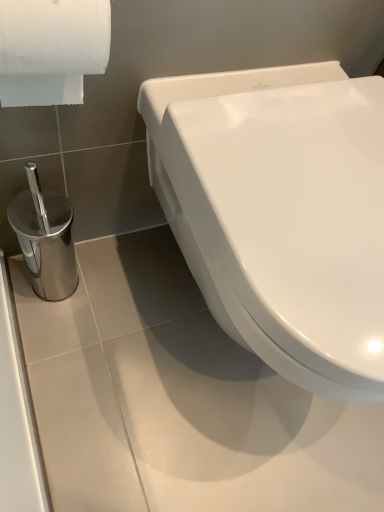
Image resolution: width=384 pixels, height=512 pixels. What do you see at coordinates (51, 49) in the screenshot?
I see `white textured toilet paper at upper left` at bounding box center [51, 49].

Find the location of `white textured toilet paper at upper left`. white textured toilet paper at upper left is located at coordinates (51, 49).

What is the approximate height of white textured toilet paper at upper left?

white textured toilet paper at upper left is 8.76 inches tall.

Describe the element at coordinates (283, 212) in the screenshot. I see `white glossy toilet at center` at that location.

In the scene shown: Measure the distance between point (308, 163) and camera.

The distance of point (308, 163) from camera is 21.65 inches.

At what (x,y) coordinates should I click in order to perform the action: click on white glossy toilet at center. Please return your answer as a coordinate pair (x, y). Looking at the image, I should click on (283, 212).

In order to face white glossy toilet at center, should I rotate leftwards or rightwards?

Rotate your view right by about 11.772°.

Identify the location of white textured toilet paper at upper left. The width and height of the screenshot is (384, 512). (51, 49).

In the scene shown: Considering the relative positions of white glossy toilet at center and white textured toilet paper at upper left in the image provided, is white glossy toilet at center to the left of white textured toilet paper at upper left from the viewer's perspective?

No.

Considering the relative positions of white glossy toilet at center and white textured toilet paper at upper left in the image provided, is white glossy toilet at center in front of white textured toilet paper at upper left?

No, it is not.

Is point (379, 240) positioned before point (10, 94)?

Yes, point (379, 240) is in front of point (10, 94).

From the image's perspective, is white glossy toilet at center located beneath white textured toilet paper at upper left?

Yes.

Consider the image. From a real-world perspective, which object rests below the other?

white glossy toilet at center is physically lower.

Is white glossy toilet at center wider than white textured toilet paper at upper left?

Indeed, white glossy toilet at center has a greater width compared to white textured toilet paper at upper left.

Who is shorter, white glossy toilet at center or white textured toilet paper at upper left?

white textured toilet paper at upper left.

Does white glossy toilet at center have a larger size compared to white textured toilet paper at upper left?

Correct, white glossy toilet at center is larger in size than white textured toilet paper at upper left.

Is white textured toilet paper at upper left completely or partially inside white glossy toilet at center?

No, white textured toilet paper at upper left is not a part of white glossy toilet at center.

Is white glossy toilet at center not close to white textured toilet paper at upper left?

No, white glossy toilet at center is not far away from white textured toilet paper at upper left.

Is white glossy toilet at center aimed at white textured toilet paper at upper left?

No, white glossy toilet at center is not aimed at white textured toilet paper at upper left.

Can you tell me how much white glossy toilet at center and white textured toilet paper at upper left differ in facing direction?

The angle between the facing direction of white glossy toilet at center and the facing direction of white textured toilet paper at upper left is 0.105 degrees.

The image size is (384, 512). I want to click on toilet below the white textured toilet paper at upper left (from a real-world perspective), so click(283, 212).

Based on their positions, is white textured toilet paper at upper left located to the left or right of white glossy toilet at center?

white textured toilet paper at upper left is to the left of white glossy toilet at center.

Between white textured toilet paper at upper left and white glossy toilet at center, which one is positioned behind?

Result: white glossy toilet at center is further from the camera.

Which is farther from the camera, (64, 100) or (292, 243)?

The point (64, 100) is farther from the camera.

From the image's perspective, is white textured toilet paper at upper left located beneath white glossy toilet at center?

No, from the image's perspective, white textured toilet paper at upper left is not beneath white glossy toilet at center.

From a real-world perspective, relative to white glossy toilet at center, is white textured toilet paper at upper left vertically above or below?

white textured toilet paper at upper left is above white glossy toilet at center.

Considering the relative sizes of white textured toilet paper at upper left and white glossy toilet at center in the image provided, is white textured toilet paper at upper left wider than white glossy toilet at center?

Incorrect, the width of white textured toilet paper at upper left does not surpass that of white glossy toilet at center.

Does white textured toilet paper at upper left have a greater height compared to white glossy toilet at center?

Incorrect, the height of white textured toilet paper at upper left is not larger of that of white glossy toilet at center.

Which of these two, white textured toilet paper at upper left or white glossy toilet at center, is bigger?

Bigger between the two is white glossy toilet at center.

Is white textured toilet paper at upper left inside the boundaries of white glossy toilet at center, or outside?

white textured toilet paper at upper left is outside white glossy toilet at center.

Is white textured toilet paper at upper left next to white glossy toilet at center and touching it?

white textured toilet paper at upper left and white glossy toilet at center are not in contact.

Could you tell me if white textured toilet paper at upper left is turned towards white glossy toilet at center?

No, white textured toilet paper at upper left is not oriented towards white glossy toilet at center.

What's the angular difference between white textured toilet paper at upper left and white glossy toilet at center's facing directions?

There is a 0.105-degree angle between the facing directions of white textured toilet paper at upper left and white glossy toilet at center.

Locate an element on the screen. Image resolution: width=384 pixels, height=512 pixels. toilet on the right of white textured toilet paper at upper left is located at coordinates (283, 212).

This screenshot has width=384, height=512. In order to click on toilet below the white textured toilet paper at upper left (from the image's perspective) in this screenshot , I will do `click(283, 212)`.

I want to click on toilet paper in front of the white glossy toilet at center, so click(x=51, y=49).